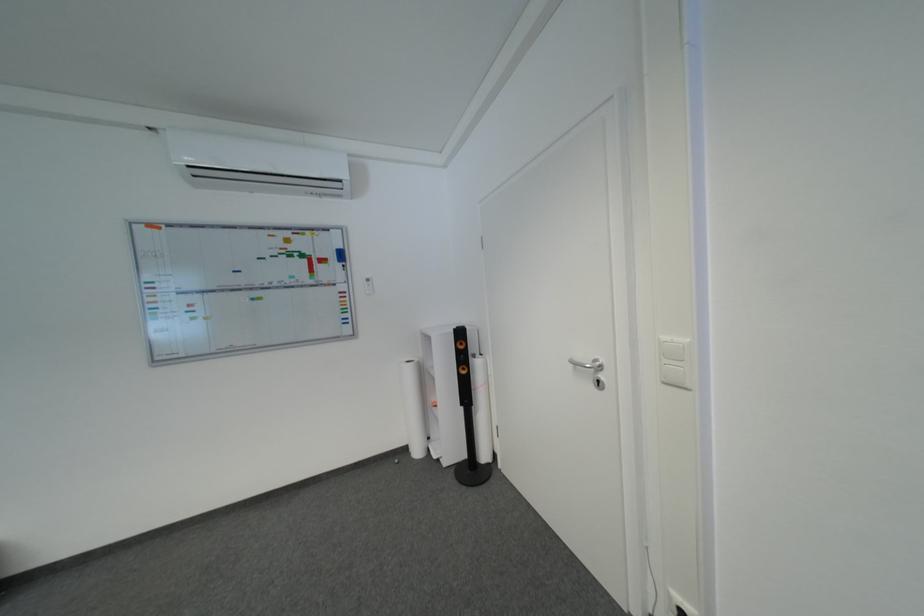
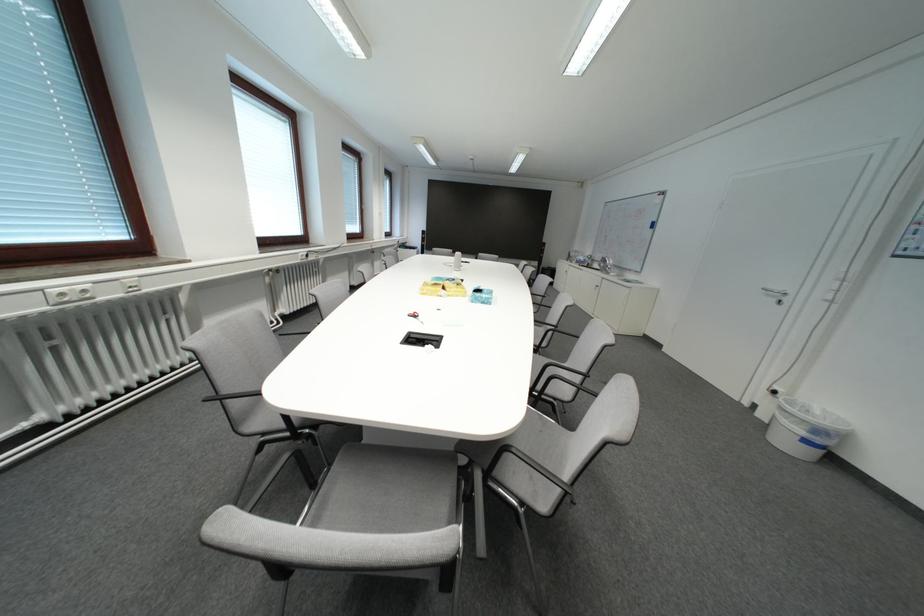
Based on the continuous images, in which direction is the camera rotating?

The camera's rotation is toward left-down.